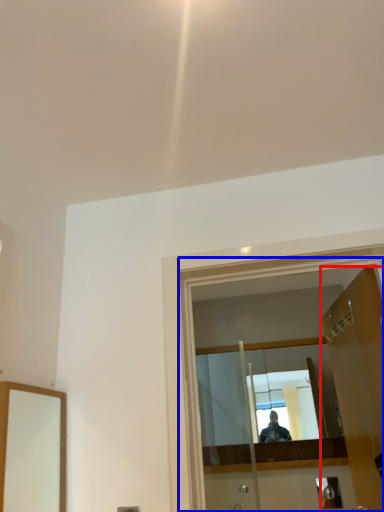
Question: Which of the following is the farthest to the observer, door (highlighted by a red box) or glass door (highlighted by a blue box)?

Choices:
 (A) door
 (B) glass door

Answer: (A)